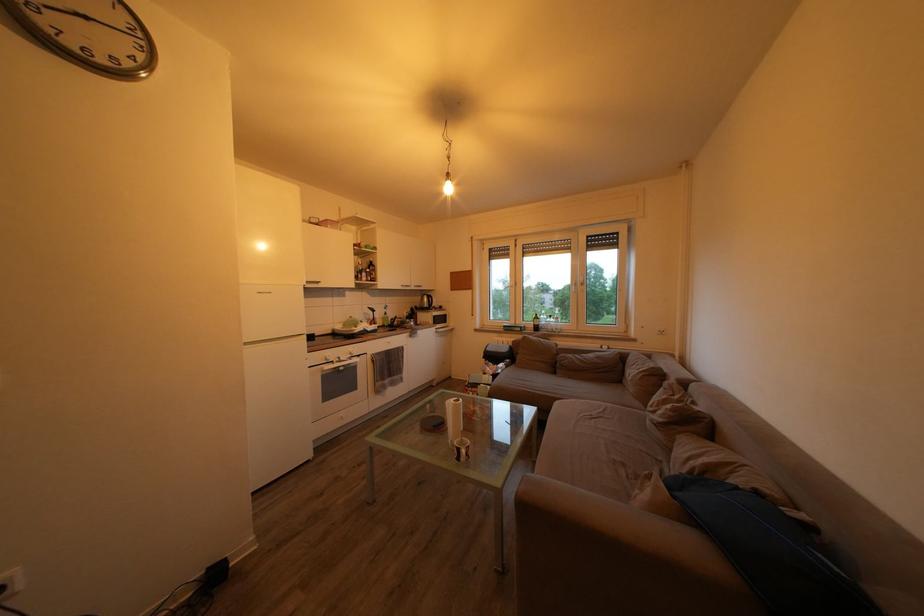
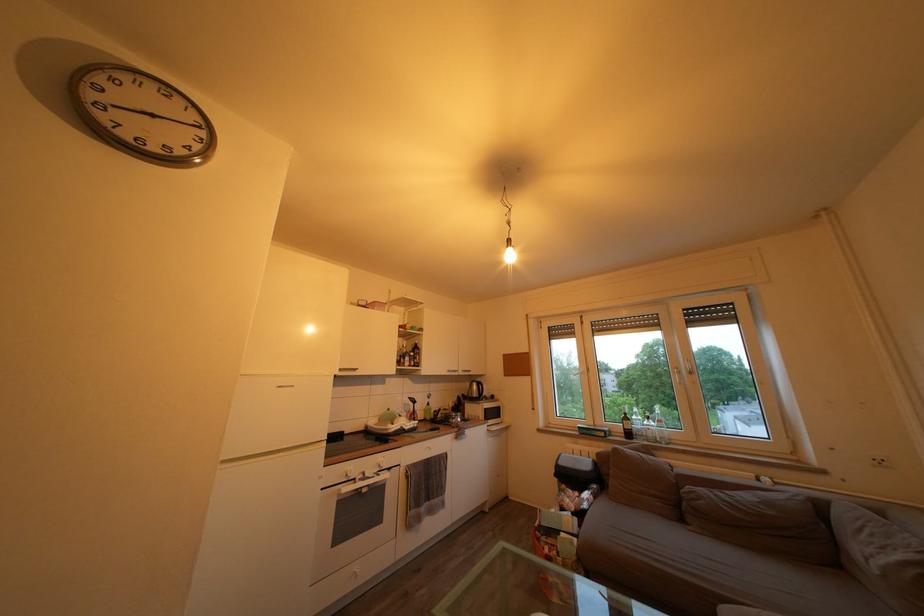
In the second image, find the point that corresponds to point (606, 363) in the first image.

(774, 509)